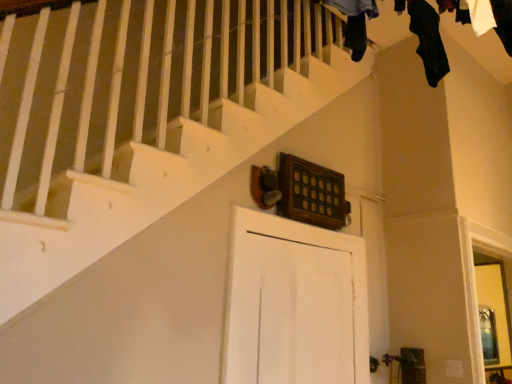
Identify the location of free space above white matte door at center (from a real-world perspective). (306, 224).